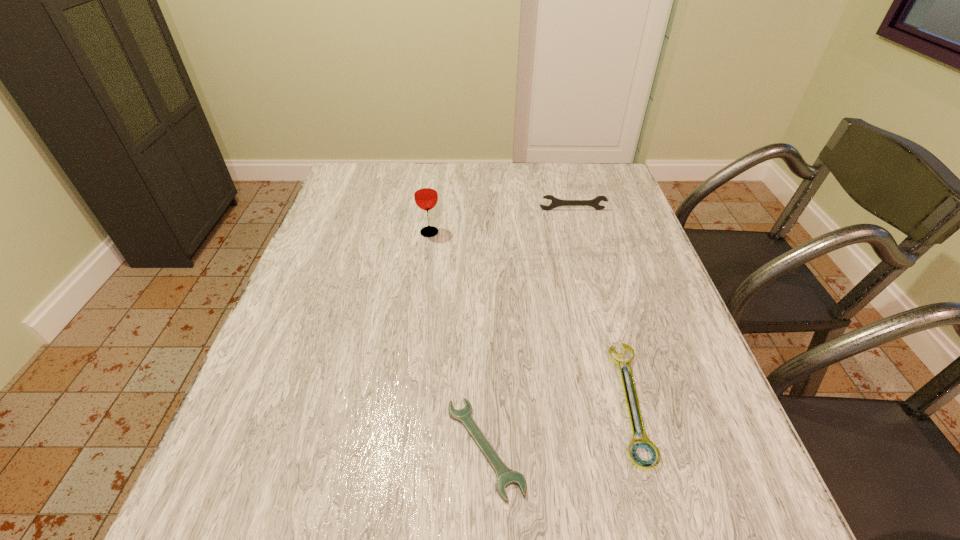
The height and width of the screenshot is (540, 960). What are the coordinates of `free spot between the tallest wrench and the leftmost wrench` in the screenshot? It's located at (529, 328).

Image resolution: width=960 pixels, height=540 pixels. What are the coordinates of `free space between the leftmost object and the leftmost wrench` in the screenshot? It's located at (457, 340).

Image resolution: width=960 pixels, height=540 pixels. I want to click on vacant point located between the leftmost wrench and the glass, so click(457, 340).

At what (x,y) coordinates should I click in order to perform the action: click on object that is the third closest to the third object from right to left. Please return your answer as a coordinate pair (x, y). Looking at the image, I should click on (555, 202).

Select which object is the closest to the third shortest object. Please provide its 2D coordinates. Your answer should be formatted as a tuple, i.e. [(x, y)], where the tuple contains the x and y coordinates of a point satisfying the conditions above.

[(425, 191)]

This screenshot has height=540, width=960. I want to click on wrench that is the second closest to the farthest wrench, so click(x=505, y=476).

Locate an element on the screen. wrench that is the second closest one to the farthest object is located at coordinates (505, 476).

At what (x,y) coordinates should I click in order to perform the action: click on vacant point that satisfies the following two spatial constraints: 1. on the front side of the leftmost wrench; 2. on the right side of the tallest object. Please return your answer as a coordinate pair (x, y). The height and width of the screenshot is (540, 960). Looking at the image, I should click on (400, 447).

Where is `vacant space that satisfies the following two spatial constraints: 1. on the front side of the glass; 2. on the right side of the leftmost wrench`? vacant space that satisfies the following two spatial constraints: 1. on the front side of the glass; 2. on the right side of the leftmost wrench is located at coordinates (400, 447).